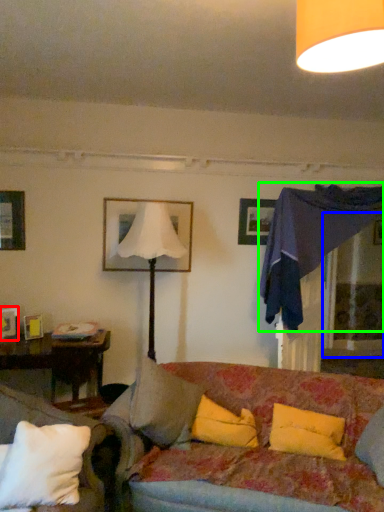
Question: Estimate the real-world distances between objects in this image. Which object is closer to picture frame (highlighted by a red box), glass door (highlighted by a blue box) or canopy bed (highlighted by a green box)?

Choices:
 (A) glass door
 (B) canopy bed

Answer: (B)